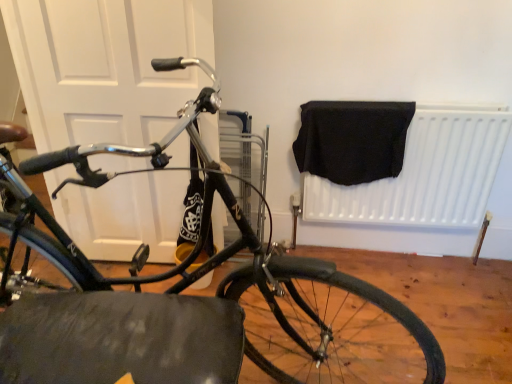
Question: Does white matte radiator at upper right have a greater height compared to black rubber tire at lower center?

Choices:
 (A) no
 (B) yes

Answer: (B)

Question: Is white matte radiator at upper right turned away from black rubber tire at lower center?

Choices:
 (A) no
 (B) yes

Answer: (A)

Question: Is white matte radiator at upper right positioned before black rubber tire at lower center?

Choices:
 (A) yes
 (B) no

Answer: (B)

Question: Can you confirm if white matte radiator at upper right is bigger than black rubber tire at lower center?

Choices:
 (A) yes
 (B) no

Answer: (A)

Question: Considering the relative sizes of white matte radiator at upper right and black rubber tire at lower center in the image provided, is white matte radiator at upper right smaller than black rubber tire at lower center?

Choices:
 (A) no
 (B) yes

Answer: (A)

Question: Are white matte radiator at upper right and black rubber tire at lower center located far from each other?

Choices:
 (A) no
 (B) yes

Answer: (A)

Question: From the image's perspective, would you say white matte door at left is positioned over black rubber tire at lower center?

Choices:
 (A) yes
 (B) no

Answer: (A)

Question: Is white matte door at left thinner than black rubber tire at lower center?

Choices:
 (A) yes
 (B) no

Answer: (A)

Question: Does white matte door at left have a lesser height compared to black rubber tire at lower center?

Choices:
 (A) yes
 (B) no

Answer: (B)

Question: Is white matte door at left wider than black rubber tire at lower center?

Choices:
 (A) no
 (B) yes

Answer: (A)

Question: Can you confirm if white matte door at left is positioned to the left of black rubber tire at lower center?

Choices:
 (A) no
 (B) yes

Answer: (B)

Question: Is the position of white matte door at left less distant than that of black rubber tire at lower center?

Choices:
 (A) no
 (B) yes

Answer: (A)

Question: From the image's perspective, is black fabric at upper right over white matte door at left?

Choices:
 (A) yes
 (B) no

Answer: (B)